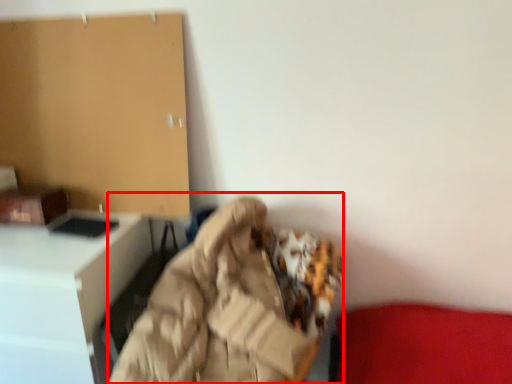
Question: From the image, what is the correct spatial relationship of bean bag chair (annotated by the red box) in relation to furniture?

Choices:
 (A) right
 (B) left

Answer: (A)